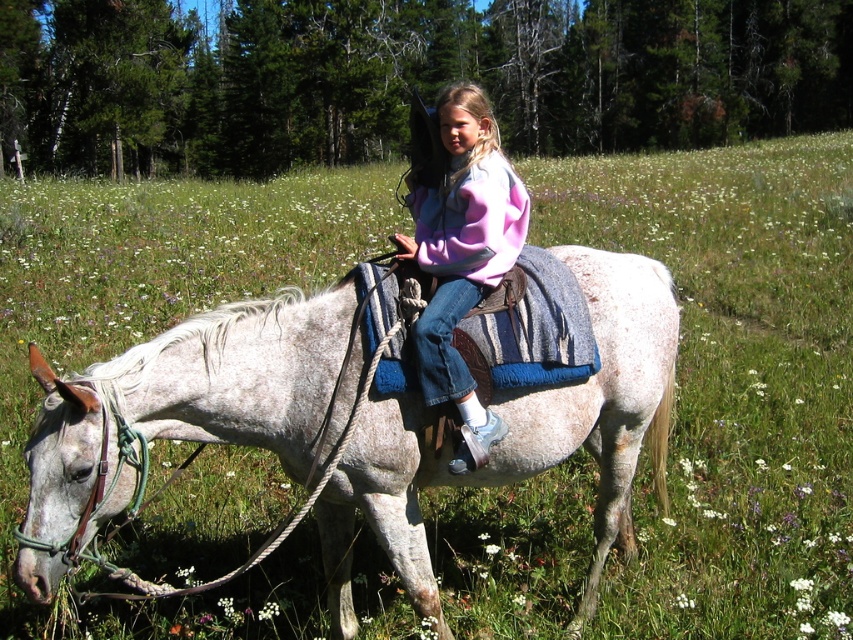
Question: Does speckled white horse at center appear on the right side of pastel fleece sweater at center?

Choices:
 (A) yes
 (B) no

Answer: (A)

Question: Which point is closer to the camera?

Choices:
 (A) speckled white horse at center
 (B) pastel fleece sweater at center

Answer: (A)

Question: Can you confirm if speckled white horse at center is smaller than pastel fleece sweater at center?

Choices:
 (A) yes
 (B) no

Answer: (A)

Question: Does speckled white horse at center have a lesser width compared to pastel fleece sweater at center?

Choices:
 (A) no
 (B) yes

Answer: (A)